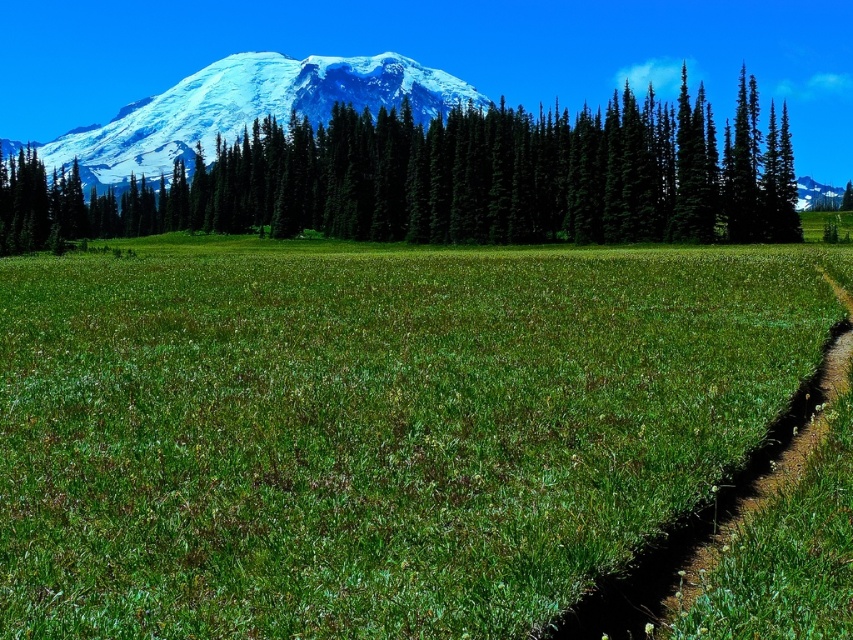
Is point (271, 602) positioned after point (349, 211)?

No, it is not.

Which of these two, green grassy pasture at center or green matte trees at upper center, stands shorter?

green grassy pasture at center

Identify the location of green grassy pasture at center. (373, 426).

Is green matte trees at upper center positioned before snowy white mountain at upper left?

Yes, it is.

From the picture: Does green matte trees at upper center appear over snowy white mountain at upper left?

No, green matte trees at upper center is not above snowy white mountain at upper left.

Does point (283, 157) come behind point (294, 81)?

No, it is not.

Locate an element on the screen. This screenshot has width=853, height=640. green matte trees at upper center is located at coordinates (447, 179).

Is green grassy pasture at center to the right of brown dirt path at lower right from the viewer's perspective?

Incorrect, green grassy pasture at center is not on the right side of brown dirt path at lower right.

Which is above, green grassy pasture at center or brown dirt path at lower right?

green grassy pasture at center is above.

Between point (183, 516) and point (650, 618), which one is positioned behind?

The point (183, 516) is behind.

This screenshot has height=640, width=853. I want to click on green grassy pasture at center, so click(x=373, y=426).